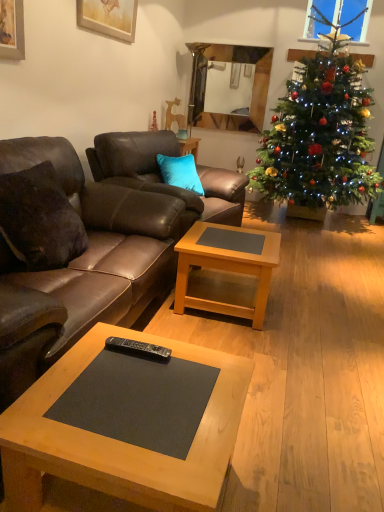
This screenshot has width=384, height=512. What do you see at coordinates (74, 259) in the screenshot? I see `brown leather couch at left, which is counted as the 2th studio couch, starting from the back` at bounding box center [74, 259].

At what (x,y) coordinates should I click in order to perform the action: click on dark brown leather pillow at left. Please return your answer as a coordinate pair (x, y). Looking at the image, I should click on (40, 219).

Describe the element at coordinates (120, 442) in the screenshot. I see `wooden matte coffee table at center, placed as the 1th coffee table when sorted from front to back` at that location.

In order to face glossy wood mirror at upper center, should I rotate leftwards or rightwards?

To face it directly, rotate right by 4.031 degrees.

Where is `clear glass window screen at upper right`? The height and width of the screenshot is (512, 384). clear glass window screen at upper right is located at coordinates (338, 18).

Where is `brown leather couch at left, which is the 1th studio couch in front-to-back order`? This screenshot has width=384, height=512. brown leather couch at left, which is the 1th studio couch in front-to-back order is located at coordinates (74, 259).

Is brown leather couch at left, which is the 1th studio couch in front-to-back order, positioned with its back to green matte christmas tree at right?

No, green matte christmas tree at right is not at the back of brown leather couch at left, which is the 1th studio couch in front-to-back order.

Looking at this image, is brown leather couch at left, which is counted as the 2th studio couch, starting from the back, further to camera compared to green matte christmas tree at right?

That is False.

Is brown leather couch at left, which is counted as the 2th studio couch, starting from the back, positioned far away from green matte christmas tree at right?

brown leather couch at left, which is counted as the 2th studio couch, starting from the back, is far away from green matte christmas tree at right.

From the picture: Which is more to the right, brown leather couch at left, which is counted as the 2th studio couch, starting from the back, or green matte christmas tree at right?

From the viewer's perspective, green matte christmas tree at right appears more on the right side.

Is wooden picture frame at upper center far away from clear glass window screen at upper right?

wooden picture frame at upper center is far away from clear glass window screen at upper right.

You are a GUI agent. You are given a task and a screenshot of the screen. Output one action in this format:
    pyautogui.click(x=<x>, y=<y>)
    Task: Click on the picture frame below the clear glass window screen at upper right (from a real-world perspective)
    
    Given the screenshot: What is the action you would take?
    pyautogui.click(x=109, y=17)

From a real-world perspective, relative to clear glass window screen at upper right, is wooden picture frame at upper center vertically above or below?

wooden picture frame at upper center is below clear glass window screen at upper right.

From the image's perspective, is wooden picture frame at upper center located above or below clear glass window screen at upper right?

wooden picture frame at upper center is below clear glass window screen at upper right.

Based on the photo, from the image's perspective, which one is positioned lower, dark brown leather pillow at left or glossy wood mirror at upper center?

dark brown leather pillow at left, from the image's perspective.

In the scene shown: Is dark brown leather pillow at left positioned in front of glossy wood mirror at upper center?

Yes, the depth of dark brown leather pillow at left is less than that of glossy wood mirror at upper center.

Based on the photo, looking at their sizes, would you say dark brown leather pillow at left is wider or thinner than glossy wood mirror at upper center?

Clearly, dark brown leather pillow at left has more width compared to glossy wood mirror at upper center.

Is dark brown leather pillow at left at the right side of glossy wood mirror at upper center?

No, dark brown leather pillow at left is not to the right of glossy wood mirror at upper center.

Considering the sizes of wooden picture frame at upper center and brown leather couch at center, the 1th studio couch when ordered from back to front, in the image, is wooden picture frame at upper center bigger or smaller than brown leather couch at center, the 1th studio couch when ordered from back to front,?

A: Clearly, wooden picture frame at upper center is smaller in size than brown leather couch at center, the 1th studio couch when ordered from back to front.

Does wooden picture frame at upper center come in front of brown leather couch at center, the 1th studio couch when ordered from back to front?

No, wooden picture frame at upper center is further to the viewer.

Is wooden picture frame at upper center to the left of brown leather couch at center, positioned as the 2th studio couch in front-to-back order, from the viewer's perspective?

Correct, you'll find wooden picture frame at upper center to the left of brown leather couch at center, positioned as the 2th studio couch in front-to-back order.

Considering the sizes of objects wooden picture frame at upper center and brown leather couch at center, the 1th studio couch when ordered from back to front, in the image provided, who is shorter, wooden picture frame at upper center or brown leather couch at center, the 1th studio couch when ordered from back to front,?

wooden picture frame at upper center is shorter.

Is light brown wooden coffee table at center, which is the 2th coffee table from front to back, far away from green matte christmas tree at right?

Yes.

Identify the location of christmas tree that is above the light brown wooden coffee table at center, which is the first coffee table from back to front (from the image's perspective). The width and height of the screenshot is (384, 512). (320, 133).

From the picture: Is light brown wooden coffee table at center, which is the first coffee table from back to front, turned away from green matte christmas tree at right?

No, light brown wooden coffee table at center, which is the first coffee table from back to front, is not facing the opposite direction of green matte christmas tree at right.

Considering the sizes of objects brown leather couch at center, the 1th studio couch when ordered from back to front, and brown leather couch at left, which is the 1th studio couch in front-to-back order, in the image provided, who is bigger, brown leather couch at center, the 1th studio couch when ordered from back to front, or brown leather couch at left, which is the 1th studio couch in front-to-back order,?

With larger size is brown leather couch at left, which is the 1th studio couch in front-to-back order.

Between point (161, 152) and point (126, 234), which one is positioned in front?

Positioned in front is point (126, 234).

Would you say brown leather couch at center, positioned as the 2th studio couch in front-to-back order, is inside or outside brown leather couch at left, which is the 1th studio couch in front-to-back order?

brown leather couch at center, positioned as the 2th studio couch in front-to-back order, lies outside brown leather couch at left, which is the 1th studio couch in front-to-back order.

Can you tell me how much brown leather couch at center, positioned as the 2th studio couch in front-to-back order, and brown leather couch at left, which is counted as the 2th studio couch, starting from the back, differ in facing direction?

The facing directions of brown leather couch at center, positioned as the 2th studio couch in front-to-back order, and brown leather couch at left, which is counted as the 2th studio couch, starting from the back, are 12.6 degrees apart.

Who is taller, light brown wooden coffee table at center, which is the 2th coffee table from front to back, or wooden matte coffee table at center, placed as the 1th coffee table when sorted from front to back?

With more height is light brown wooden coffee table at center, which is the 2th coffee table from front to back.

You are a GUI agent. You are given a task and a screenshot of the screen. Output one action in this format:
    pyautogui.click(x=<x>, y=<y>)
    Task: Click on the coffee table lying above the wooden matte coffee table at center, placed as the 1th coffee table when sorted from front to back (from the image's perspective)
    This screenshot has width=384, height=512.
    Given the screenshot: What is the action you would take?
    pyautogui.click(x=226, y=268)

Does point (231, 239) appear closer or farther from the camera than point (20, 406)?

Point (231, 239) is farther from the camera than point (20, 406).

Would you say light brown wooden coffee table at center, which is the 2th coffee table from front to back, is inside or outside wooden matte coffee table at center, placed as the 1th coffee table when sorted from front to back?

light brown wooden coffee table at center, which is the 2th coffee table from front to back, lies outside wooden matte coffee table at center, placed as the 1th coffee table when sorted from front to back.

I want to click on christmas tree that appears above the brown leather couch at left, which is the 1th studio couch in front-to-back order (from the image's perspective), so click(x=320, y=133).

Locate an element on the screen. picture frame located in front of the clear glass window screen at upper right is located at coordinates point(109,17).

Which object lies nearer to the anchor point green matte christmas tree at right, wooden matte coffee table at center, acting as the second coffee table starting from the back, or black plastic remote control at center?

Based on the image, wooden matte coffee table at center, acting as the second coffee table starting from the back, appears to be nearer to green matte christmas tree at right.

Looking at the image, which one is located further to wooden picture frame at upper center, black plastic remote control at center or clear glass window screen at upper right?

clear glass window screen at upper right is positioned further to the anchor wooden picture frame at upper center.

Looking at this image, from the image, which object appears to be farther from green matte christmas tree at right, wooden picture frame at upper center or clear glass window screen at upper right?

wooden picture frame at upper center is positioned further to the anchor green matte christmas tree at right.

Estimate the real-world distances between objects in this image. Which object is closer to green matte christmas tree at right, clear glass window screen at upper right or brown leather couch at center, positioned as the 2th studio couch in front-to-back order?

Based on the image, brown leather couch at center, positioned as the 2th studio couch in front-to-back order, appears to be nearer to green matte christmas tree at right.

Based on the photo, which object lies nearer to the anchor point green matte christmas tree at right, clear glass window screen at upper right or black plastic remote control at center?

clear glass window screen at upper right.

Which object lies nearer to the anchor point wooden matte coffee table at center, acting as the second coffee table starting from the back, glossy wood mirror at upper center or clear glass window screen at upper right?

Based on the image, clear glass window screen at upper right appears to be nearer to wooden matte coffee table at center, acting as the second coffee table starting from the back.

When comparing their distances from dark brown leather pillow at left, does light brown wooden coffee table at center, which is the first coffee table from back to front, or wooden matte coffee table at center, acting as the second coffee table starting from the back, seem closer?

The object closer to dark brown leather pillow at left is wooden matte coffee table at center, acting as the second coffee table starting from the back.

Estimate the real-world distances between objects in this image. Which object is further from light brown wooden coffee table at center, which is the 2th coffee table from front to back, dark brown leather pillow at left or brown leather couch at center, the 1th studio couch when ordered from back to front?

dark brown leather pillow at left is further to light brown wooden coffee table at center, which is the 2th coffee table from front to back.

This screenshot has width=384, height=512. I want to click on coffee table between brown leather couch at left, which is the 1th studio couch in front-to-back order, and glossy wood mirror at upper center, along the z-axis, so click(x=226, y=268).

Where is `picture frame between brown leather couch at center, the 1th studio couch when ordered from back to front, and glossy wood mirror at upper center, along the z-axis`? picture frame between brown leather couch at center, the 1th studio couch when ordered from back to front, and glossy wood mirror at upper center, along the z-axis is located at coordinates (109, 17).

Locate an element on the screen. The image size is (384, 512). studio couch between black plastic remote control at center and glossy wood mirror at upper center in the front-back direction is located at coordinates (161, 175).

Image resolution: width=384 pixels, height=512 pixels. In order to click on studio couch located between light brown wooden coffee table at center, which is the first coffee table from back to front, and glossy wood mirror at upper center in the depth direction in this screenshot , I will do `click(161, 175)`.